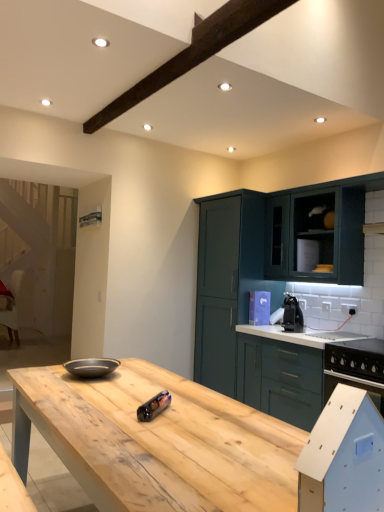
What do you see at coordinates (283, 371) in the screenshot?
I see `green matte cabinet at right, which appears as the third cabinetry when viewed from the back` at bounding box center [283, 371].

In order to face green matte cabinet at right, which appears as the third cabinetry when viewed from the back, should I rotate leftwards or rightwards?

You should look right and rotate roughly 14.432 degrees.

I want to click on teal matte cabinet at upper right, which is counted as the first cabinetry, starting from the back, so click(226, 282).

Measure the distance between metallic cylindrical can at center, which ranks as the second appliance in right-to-left order, and camera.

The distance of metallic cylindrical can at center, which ranks as the second appliance in right-to-left order, from camera is 5.55 feet.

The height and width of the screenshot is (512, 384). I want to click on black plastic coffee machine at center, which is counted as the 2th appliance, starting from the left, so [292, 314].

Find the location of `white fabric chair at left`. white fabric chair at left is located at coordinates (11, 305).

Would you consider white fabric chair at left to be distant from metallic cylindrical can at center, placed as the 1th appliance when sorted from left to right?

white fabric chair at left is far away from metallic cylindrical can at center, placed as the 1th appliance when sorted from left to right.

Is white fabric chair at left to the right of metallic cylindrical can at center, the 2th appliance when ordered from back to front, from the viewer's perspective?

In fact, white fabric chair at left is to the left of metallic cylindrical can at center, the 2th appliance when ordered from back to front.

Based on their sizes in the image, would you say white fabric chair at left is bigger or smaller than metallic cylindrical can at center, which ranks as the second appliance in right-to-left order?

white fabric chair at left is bigger than metallic cylindrical can at center, which ranks as the second appliance in right-to-left order.

Considering the points (16, 307) and (145, 419), which point is in front, point (16, 307) or point (145, 419)?

Positioned in front is point (145, 419).

Is there a large distance between black plastic coffee machine at center, which is counted as the 2th appliance, starting from the front, and natural wood table at center?

Indeed, black plastic coffee machine at center, which is counted as the 2th appliance, starting from the front, is not near natural wood table at center.

From a real-world perspective, which object rests below the other?

natural wood table at center is physically lower.

From the image's perspective, relative to natural wood table at center, is black plastic coffee machine at center, placed as the first appliance when sorted from top to bottom, above or below?

Based on their image positions, black plastic coffee machine at center, placed as the first appliance when sorted from top to bottom, is located above natural wood table at center.

Which point is more distant from viewer, (316, 191) or (269, 473)?

The point (316, 191) is farther from the camera.

Can you confirm if matte dark teal cabinet at upper right, which appears as the 2th cabinetry when viewed from the front, is positioned to the right of natural wood table at center?

Indeed, matte dark teal cabinet at upper right, which appears as the 2th cabinetry when viewed from the front, is positioned on the right side of natural wood table at center.

Considering the relative sizes of matte dark teal cabinet at upper right, which appears as the 2th cabinetry when viewed from the front, and natural wood table at center in the image provided, is matte dark teal cabinet at upper right, which appears as the 2th cabinetry when viewed from the front, taller than natural wood table at center?

Indeed, matte dark teal cabinet at upper right, which appears as the 2th cabinetry when viewed from the front, has a greater height compared to natural wood table at center.

At what (x,y) coordinates should I click in order to perform the action: click on appliance in front of the matte dark teal cabinet at upper right, marked as the second cabinetry in a back-to-front arrangement. Please return your answer as a coordinate pair (x, y). The width and height of the screenshot is (384, 512). Looking at the image, I should click on (154, 406).

Based on their sizes in the image, would you say metallic cylindrical can at center, marked as the 1th appliance in a bottom-to-top arrangement, is bigger or smaller than matte dark teal cabinet at upper right, marked as the second cabinetry in a back-to-front arrangement?

Clearly, metallic cylindrical can at center, marked as the 1th appliance in a bottom-to-top arrangement, is smaller in size than matte dark teal cabinet at upper right, marked as the second cabinetry in a back-to-front arrangement.

From the image's perspective, between metallic cylindrical can at center, the 2th appliance when ordered from back to front, and matte dark teal cabinet at upper right, which appears as the 2th cabinetry when viewed from the front, which one is located above?

matte dark teal cabinet at upper right, which appears as the 2th cabinetry when viewed from the front, from the image's perspective.

In the scene shown: Considering the sizes of white fabric chair at left and matte dark teal cabinet at upper right, which appears as the 2th cabinetry when viewed from the front, in the image, is white fabric chair at left taller or shorter than matte dark teal cabinet at upper right, which appears as the 2th cabinetry when viewed from the front,?

white fabric chair at left is taller than matte dark teal cabinet at upper right, which appears as the 2th cabinetry when viewed from the front.

Considering the positions of objects white fabric chair at left and matte dark teal cabinet at upper right, marked as the second cabinetry in a back-to-front arrangement, in the image provided, who is more to the right, white fabric chair at left or matte dark teal cabinet at upper right, marked as the second cabinetry in a back-to-front arrangement,?

Positioned to the right is matte dark teal cabinet at upper right, marked as the second cabinetry in a back-to-front arrangement.

Between white fabric chair at left and matte dark teal cabinet at upper right, which appears as the 2th cabinetry when viewed from the front, which one has smaller width?

Thinner between the two is matte dark teal cabinet at upper right, which appears as the 2th cabinetry when viewed from the front.

Considering the positions of objects white fabric chair at left and matte dark teal cabinet at upper right, marked as the second cabinetry in a back-to-front arrangement, in the image provided, who is in front, white fabric chair at left or matte dark teal cabinet at upper right, marked as the second cabinetry in a back-to-front arrangement,?

matte dark teal cabinet at upper right, marked as the second cabinetry in a back-to-front arrangement, is closer to the camera.

Which point is more forward, (236,241) or (3,311)?

The point (236,241) is more forward.

Is teal matte cabinet at upper right, which is counted as the first cabinetry, starting from the back, spatially inside white fabric chair at left, or outside of it?

The correct answer is: outside.

Image resolution: width=384 pixels, height=512 pixels. I want to click on cabinetry that is the 1st one when counting rightward from the white fabric chair at left, so click(x=226, y=282).

Who is taller, teal matte cabinet at upper right, which is counted as the first cabinetry, starting from the back, or white fabric chair at left?

Standing taller between the two is teal matte cabinet at upper right, which is counted as the first cabinetry, starting from the back.

Considering the sizes of natural wood table at center and teal matte cabinet at upper right, which is counted as the first cabinetry, starting from the back, in the image, is natural wood table at center bigger or smaller than teal matte cabinet at upper right, which is counted as the first cabinetry, starting from the back,?

natural wood table at center is bigger than teal matte cabinet at upper right, which is counted as the first cabinetry, starting from the back.

Does natural wood table at center turn towards teal matte cabinet at upper right, which is counted as the first cabinetry, starting from the back?

No, natural wood table at center is not aimed at teal matte cabinet at upper right, which is counted as the first cabinetry, starting from the back.

Considering the positions of objects natural wood table at center and teal matte cabinet at upper right, which is counted as the first cabinetry, starting from the back, in the image provided, who is more to the left, natural wood table at center or teal matte cabinet at upper right, which is counted as the first cabinetry, starting from the back,?

natural wood table at center.

Considering their positions, is natural wood table at center located in front of or behind teal matte cabinet at upper right, the third cabinetry when ordered from front to back?

natural wood table at center is positioned closer to the viewer than teal matte cabinet at upper right, the third cabinetry when ordered from front to back.

Which appliance is the 1st one when counting from the right side of the white fabric chair at left? Please provide its 2D coordinates.

[(154, 406)]

Where is `table directly beneath the black plastic coffee machine at center, the 1th appliance positioned from the right (from a real-world perspective)`? This screenshot has height=512, width=384. table directly beneath the black plastic coffee machine at center, the 1th appliance positioned from the right (from a real-world perspective) is located at coordinates (156, 441).

When comparing their distances from matte dark teal cabinet at upper right, which appears as the 2th cabinetry when viewed from the front, does white fabric chair at left or teal matte cabinet at upper right, the third cabinetry when ordered from front to back, seem further?

white fabric chair at left lies further to matte dark teal cabinet at upper right, which appears as the 2th cabinetry when viewed from the front, than the other object.

Estimate the real-world distances between objects in this image. Which object is closer to white fabric chair at left, teal matte cabinet at upper right, which is counted as the first cabinetry, starting from the back, or black plastic coffee machine at center, the 1th appliance positioned from the right?

Among the two, teal matte cabinet at upper right, which is counted as the first cabinetry, starting from the back, is located nearer to white fabric chair at left.

When comparing their distances from natural wood table at center, does teal matte cabinet at upper right, the third cabinetry when ordered from front to back, or metallic cylindrical can at center, the 2th appliance when ordered from back to front, seem closer?

Based on the image, metallic cylindrical can at center, the 2th appliance when ordered from back to front, appears to be nearer to natural wood table at center.

From the picture: Considering their positions, is green matte cabinet at right, which appears as the third cabinetry when viewed from the back, positioned closer to white fabric chair at left than teal matte cabinet at upper right, the third cabinetry when ordered from front to back?

The object closer to white fabric chair at left is teal matte cabinet at upper right, the third cabinetry when ordered from front to back.

Which object lies further to the anchor point natural wood table at center, matte dark teal cabinet at upper right, marked as the second cabinetry in a back-to-front arrangement, or metallic cylindrical can at center, the 2th appliance when ordered from back to front?

matte dark teal cabinet at upper right, marked as the second cabinetry in a back-to-front arrangement, lies further to natural wood table at center than the other object.

Considering their positions, is black plastic coffee machine at center, which is counted as the 1th appliance, starting from the back, positioned further to white fabric chair at left than metallic cylindrical can at center, the second appliance when ordered from top to bottom?

metallic cylindrical can at center, the second appliance when ordered from top to bottom.

Based on the photo, considering their positions, is natural wood table at center positioned further to white fabric chair at left than black plastic coffee machine at center, the second appliance ordered from the bottom?

natural wood table at center lies further to white fabric chair at left than the other object.

Looking at the image, which one is located closer to green matte cabinet at right, which appears as the third cabinetry when viewed from the back, black plastic coffee machine at center, which is counted as the 2th appliance, starting from the front, or matte dark teal cabinet at upper right, which appears as the 2th cabinetry when viewed from the front?

black plastic coffee machine at center, which is counted as the 2th appliance, starting from the front.

Locate an element on the screen. appliance between natural wood table at center and matte dark teal cabinet at upper right, which appears as the 2th cabinetry when viewed from the front, in the front-back direction is located at coordinates (154, 406).

Image resolution: width=384 pixels, height=512 pixels. Find the location of `cabinetry situated between white fabric chair at left and black plastic coffee machine at center, placed as the first appliance when sorted from top to bottom, from left to right`. cabinetry situated between white fabric chair at left and black plastic coffee machine at center, placed as the first appliance when sorted from top to bottom, from left to right is located at coordinates (226, 282).

Where is `cabinetry between matte dark teal cabinet at upper right, which appears as the 2th cabinetry when viewed from the front, and black plastic coffee machine at center, the 1th appliance positioned from the right, from top to bottom`? cabinetry between matte dark teal cabinet at upper right, which appears as the 2th cabinetry when viewed from the front, and black plastic coffee machine at center, the 1th appliance positioned from the right, from top to bottom is located at coordinates (226, 282).

The height and width of the screenshot is (512, 384). I want to click on cabinetry between white fabric chair at left and green matte cabinet at right, marked as the first cabinetry in a front-to-back arrangement, from left to right, so click(x=226, y=282).